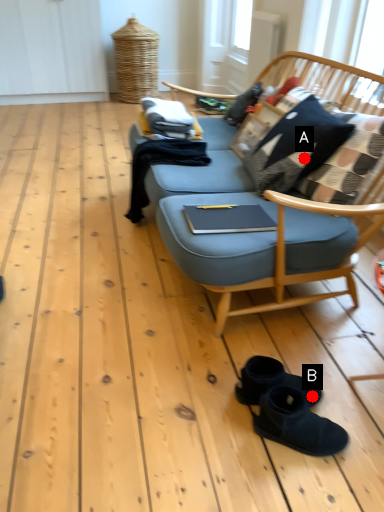
Question: Two points are circled on the image, labeled by A and B beside each circle. Which point is closer to the camera?

Choices:
 (A) A is closer
 (B) B is closer

Answer: (B)